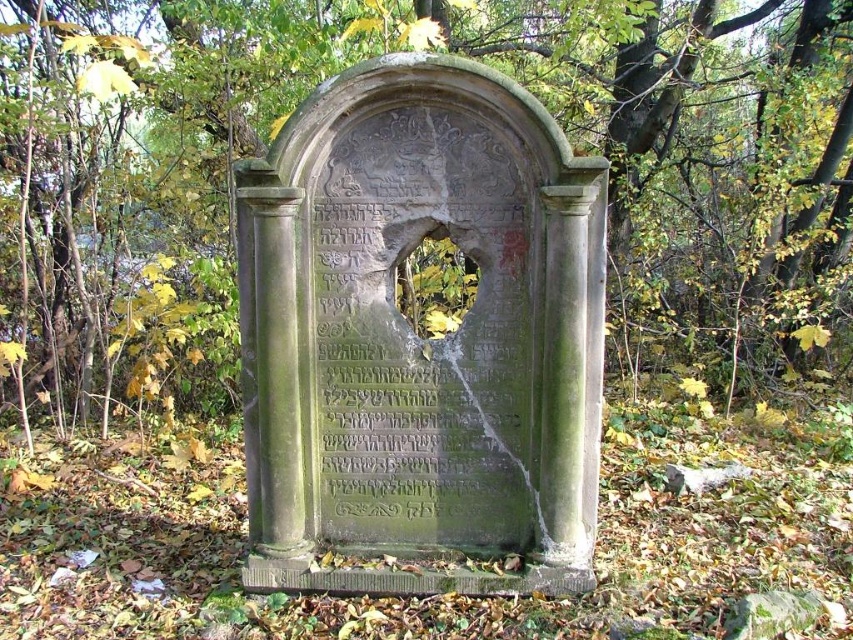
From the picture: Who is lower down, green stone tombstone at center or green stone monument at center?

Positioned lower is green stone monument at center.

Is green stone tombstone at center further to the viewer compared to green stone monument at center?

Yes, it is.

Does point (39, 369) lie behind point (386, 408)?

That is True.

You are a GUI agent. You are given a task and a screenshot of the screen. Output one action in this format:
    pyautogui.click(x=<x>, y=<y>)
    Task: Click on the green stone tombstone at center
    
    Given the screenshot: What is the action you would take?
    coord(418,49)